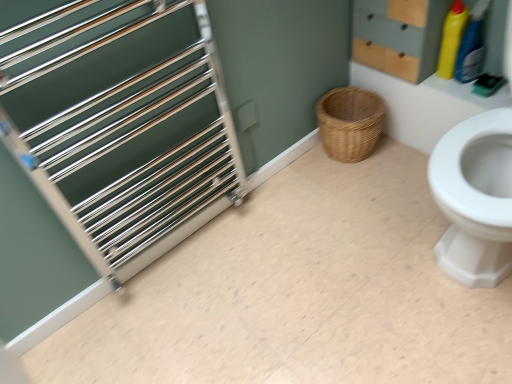
I want to click on free point in front of yellow plastic bottle at upper right, placed as the second cleaning product when sorted from right to left, so click(468, 91).